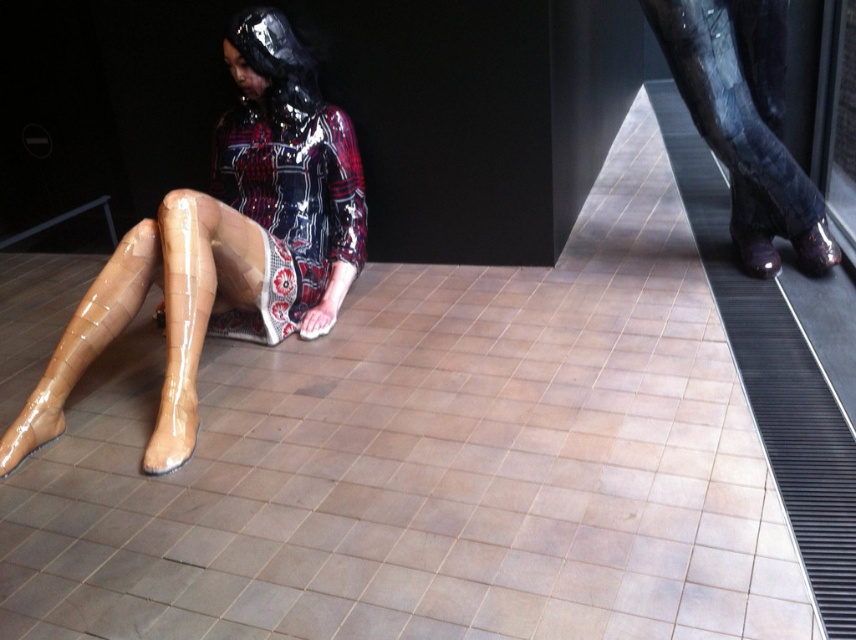
Question: Estimate the real-world distances between objects in this image. Which object is farther from the glossy tan boot at lower left?

Choices:
 (A) glossy black boot at upper right
 (B) glossy tan boots at lower left

Answer: (A)

Question: Which of the following is the farthest from the observer?

Choices:
 (A) glossy tan boot at lower left
 (B) glossy black boot at upper right

Answer: (B)

Question: Which point appears closest to the camera in this image?

Choices:
 (A) (173, 426)
 (B) (755, 4)
 (C) (298, 129)

Answer: (A)

Question: Considering the relative positions of glossy tan boots at lower left and glossy tan boot at lower left in the image provided, where is glossy tan boots at lower left located with respect to glossy tan boot at lower left?

Choices:
 (A) above
 (B) below

Answer: (A)

Question: Observing the image, what is the correct spatial positioning of glossy tan boots at lower left in reference to glossy tan boot at lower left?

Choices:
 (A) above
 (B) below

Answer: (A)

Question: Is glossy tan boots at lower left to the left of glossy tan boot at lower left from the viewer's perspective?

Choices:
 (A) yes
 (B) no

Answer: (B)